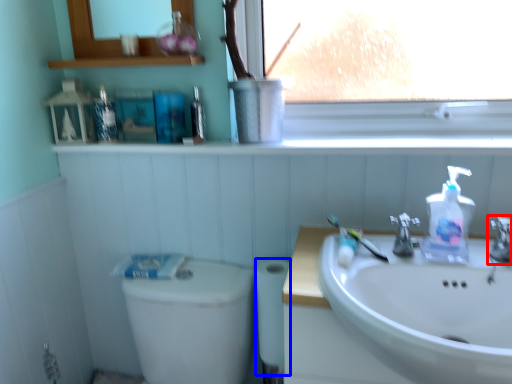
Question: Which object appears closest to the camera in this image, tap (highlighted by a red box) or toilet paper (highlighted by a blue box)?

Choices:
 (A) tap
 (B) toilet paper

Answer: (A)